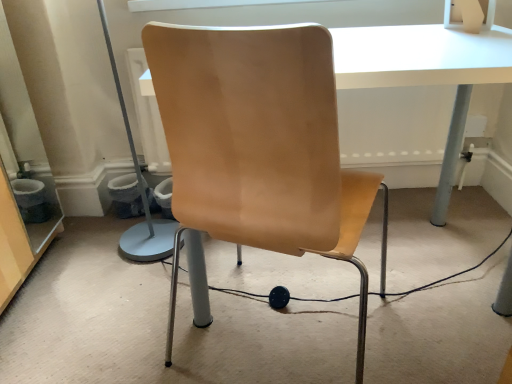
Question: Relative to white glossy table at center, is matte wood chair at center in front or behind?

Choices:
 (A) front
 (B) behind

Answer: (A)

Question: From a real-world perspective, is matte wood chair at center positioned above or below white glossy table at center?

Choices:
 (A) above
 (B) below

Answer: (A)

Question: From the image's perspective, relative to white glossy table at center, is matte wood chair at center above or below?

Choices:
 (A) below
 (B) above

Answer: (A)

Question: Is white glossy table at center situated inside matte wood chair at center or outside?

Choices:
 (A) outside
 (B) inside

Answer: (A)

Question: Is white glossy table at center bigger or smaller than matte wood chair at center?

Choices:
 (A) small
 (B) big

Answer: (B)

Question: In the image, is white glossy table at center on the left side or the right side of matte wood chair at center?

Choices:
 (A) right
 (B) left

Answer: (A)

Question: Relative to matte wood chair at center, is white glossy table at center in front or behind?

Choices:
 (A) behind
 (B) front

Answer: (A)